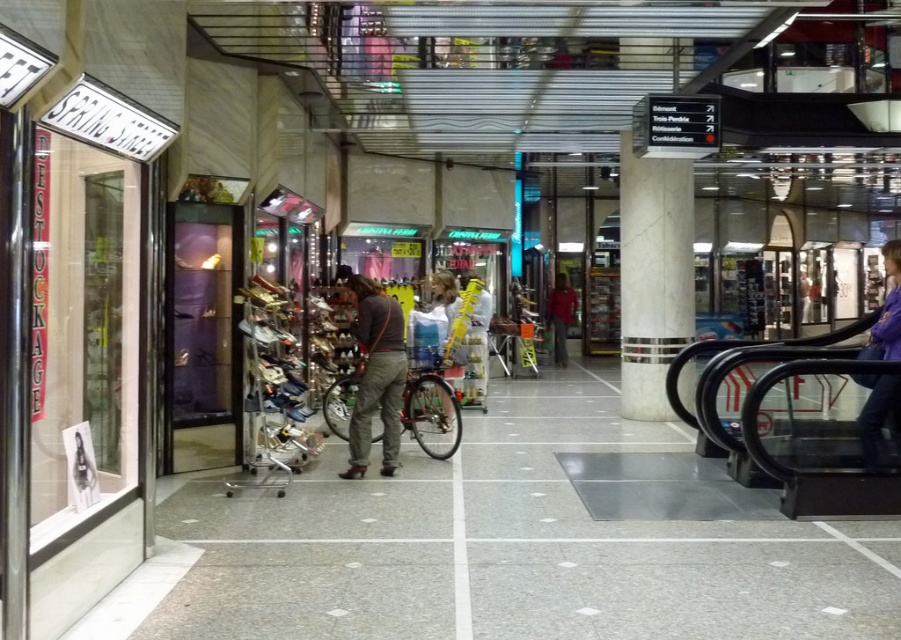
Question: Which point is closer to the camera?

Choices:
 (A) (640, 380)
 (B) (558, 352)
 (C) (421, 376)
 (D) (876, 324)

Answer: (D)

Question: Which point appears closest to the camera in this image?

Choices:
 (A) (572, 317)
 (B) (888, 346)
 (C) (419, 387)
 (D) (370, 392)

Answer: (B)

Question: Is white marble pillar at center thinner than red fabric jacket at center?

Choices:
 (A) yes
 (B) no

Answer: (B)

Question: Estimate the real-world distances between objects in this image. Which object is closer to the red fabric jacket at center?

Choices:
 (A) shiny metallic bicycle at center
 (B) purple fabric jacket at lower right
 (C) white marble pillar at center

Answer: (C)

Question: Is shiny metallic bicycle at center in front of red fabric jacket at center?

Choices:
 (A) no
 (B) yes

Answer: (B)

Question: Is the position of dark gray pants at center less distant than that of purple fabric jacket at lower right?

Choices:
 (A) yes
 (B) no

Answer: (B)